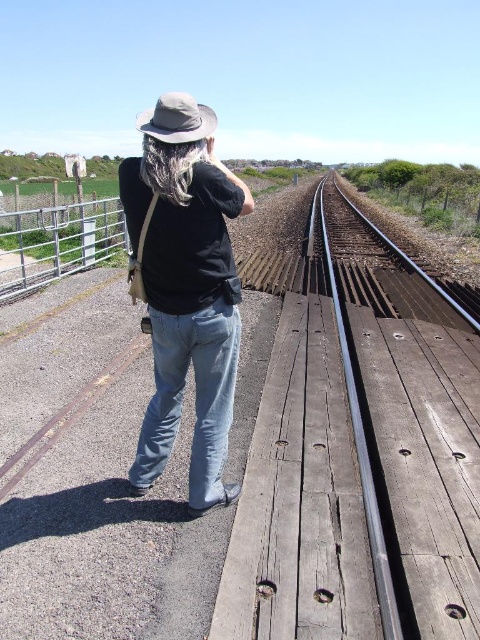
Based on the photo, you are a tailor measuring clothing items for a customer. You have the black cotton shirt at center and the khaki fabric cowboy hat at upper center. Which item has a smaller width?

The black cotton shirt at center has a smaller width than the khaki fabric cowboy hat at upper center.

You are a construction worker who needs to place a 2 meter wide equipment on the platform. The equipment must be placed between the smooth metal train track at center and the metallic gate at left. Can you fit the equipment between them?

The smooth metal train track at center has a lesser width compared to metallic gate at left. The equipment is 2 meters wide. Since the track is narrower than the gate, but the exact width of the space between them isn not provided, it is uncertain if the equipment will fit. Additional measurements are needed.